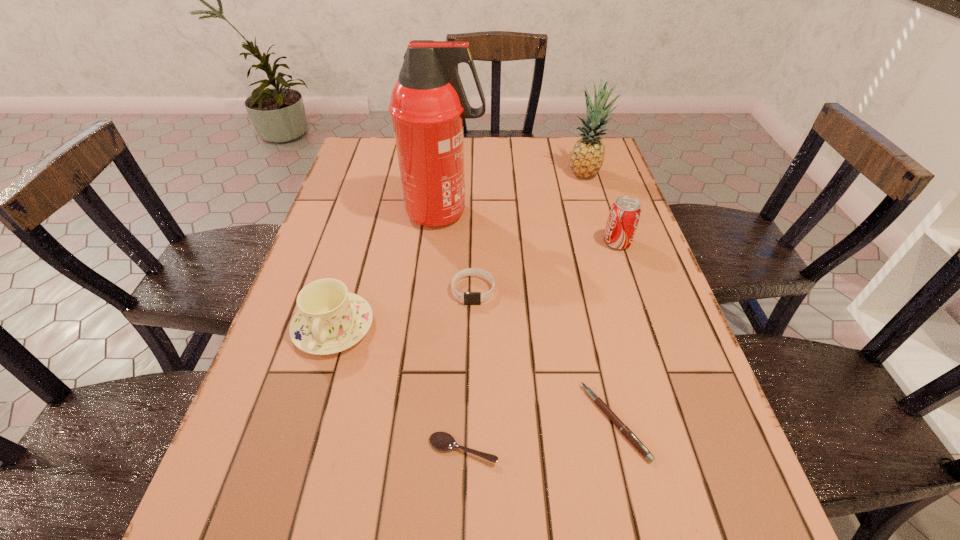
Image resolution: width=960 pixels, height=540 pixels. What are the coordinates of `the tallest object` in the screenshot? It's located at (428, 104).

Locate an element on the screen. fire extinguisher is located at coordinates (428, 104).

Identify the location of pineapple. (587, 156).

Image resolution: width=960 pixels, height=540 pixels. Find the location of `the second tallest object`. the second tallest object is located at coordinates (587, 156).

You are a GUI agent. You are given a task and a screenshot of the screen. Output one action in this format:
    pyautogui.click(x=<x>, y=<y>)
    Task: Click on the fifth nearest object
    Image resolution: width=960 pixels, height=540 pixels.
    Given the screenshot: What is the action you would take?
    pyautogui.click(x=624, y=216)

Find the location of a particular element. the fifth shortest object is located at coordinates (624, 216).

Identify the location of chinaware. The height and width of the screenshot is (540, 960). (330, 319).

Where is `the leftmost object`? The width and height of the screenshot is (960, 540). the leftmost object is located at coordinates (330, 319).

Where is `the third shortest object`? The height and width of the screenshot is (540, 960). the third shortest object is located at coordinates (469, 298).

Identify the location of the second shortest object. The width and height of the screenshot is (960, 540). (632, 438).